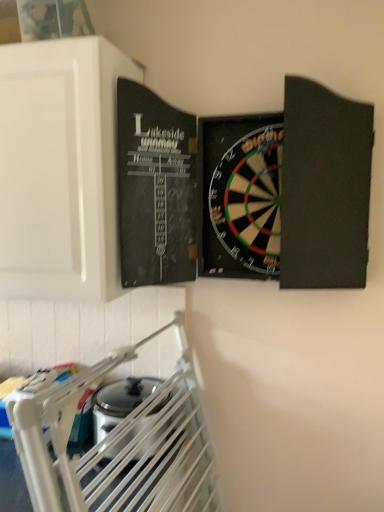
Question: Does satin silver toaster at lower left turn towards white matte cabinet at upper left?

Choices:
 (A) no
 (B) yes

Answer: (A)

Question: From a real-world perspective, is satin silver toaster at lower left on white matte cabinet at upper left?

Choices:
 (A) no
 (B) yes

Answer: (A)

Question: From the image's perspective, is satin silver toaster at lower left below white matte cabinet at upper left?

Choices:
 (A) yes
 (B) no

Answer: (A)

Question: Can you confirm if satin silver toaster at lower left is wider than white matte cabinet at upper left?

Choices:
 (A) no
 (B) yes

Answer: (A)

Question: Is the depth of satin silver toaster at lower left greater than that of white matte cabinet at upper left?

Choices:
 (A) yes
 (B) no

Answer: (A)

Question: Can you confirm if satin silver toaster at lower left is taller than white matte cabinet at upper left?

Choices:
 (A) no
 (B) yes

Answer: (A)

Question: Is satin silver toaster at lower left at the back of white matte cabinet at upper left?

Choices:
 (A) yes
 (B) no

Answer: (B)

Question: From the image's perspective, is white matte cabinet at upper left beneath satin silver toaster at lower left?

Choices:
 (A) no
 (B) yes

Answer: (A)

Question: From the image's perspective, is white matte cabinet at upper left located above satin silver toaster at lower left?

Choices:
 (A) no
 (B) yes

Answer: (B)

Question: Is white matte cabinet at upper left aimed at satin silver toaster at lower left?

Choices:
 (A) yes
 (B) no

Answer: (B)

Question: Can you confirm if white matte cabinet at upper left is thinner than satin silver toaster at lower left?

Choices:
 (A) no
 (B) yes

Answer: (A)

Question: Does white matte cabinet at upper left have a larger size compared to satin silver toaster at lower left?

Choices:
 (A) yes
 (B) no

Answer: (A)

Question: Is point (28, 62) positioned closer to the camera than point (140, 378)?

Choices:
 (A) farther
 (B) closer

Answer: (B)